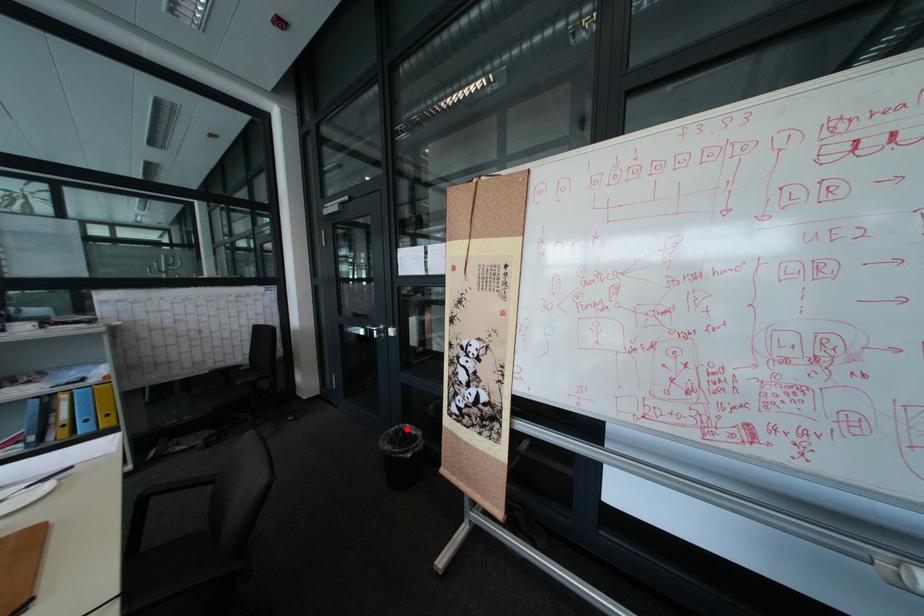
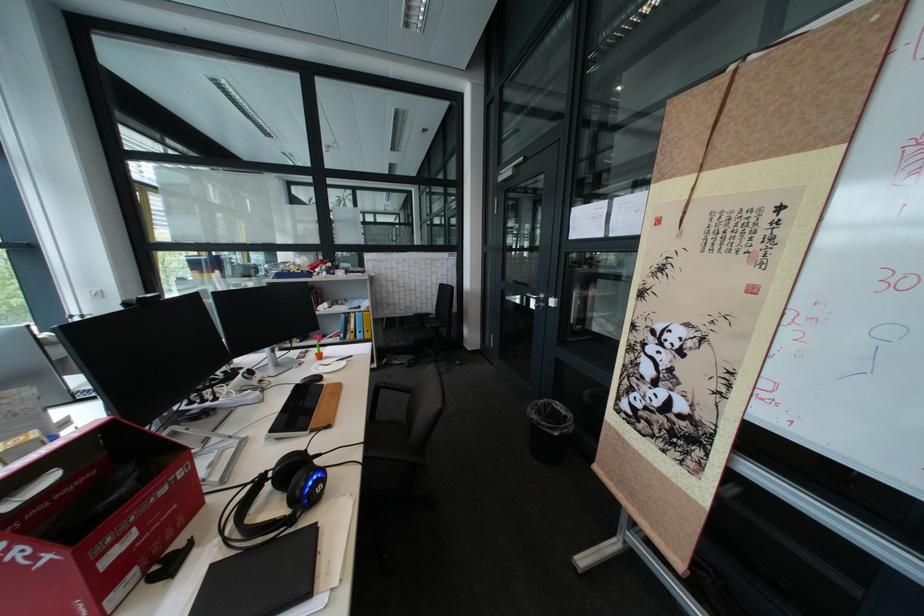
In the second image, find the point that corresponds to the highlighted location in the first image.

(555, 400)